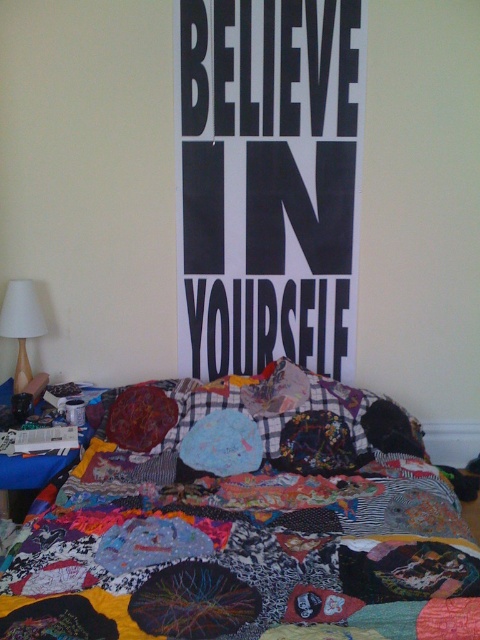
Is point (319, 33) farther from viewer compared to point (19, 355)?

No, (319, 33) is closer to viewer.

The height and width of the screenshot is (640, 480). Describe the element at coordinates (267, 182) in the screenshot. I see `black paper poster at center` at that location.

Does point (308, 244) come farther from viewer compared to point (17, 289)?

Yes, it is.

Find the location of a particular element. The width and height of the screenshot is (480, 640). black paper poster at center is located at coordinates (267, 182).

Is point (377, 508) closer to viewer compared to point (230, 340)?

Yes.

How much distance is there between patchwork quilt at center and black paper poster at center?

patchwork quilt at center is 83.21 centimeters away from black paper poster at center.

Describe the element at coordinates (250, 534) in the screenshot. I see `patchwork quilt at center` at that location.

Locate an element on the screen. patchwork quilt at center is located at coordinates tap(250, 534).

Can you confirm if patchwork quilt at center is taller than white fabric lampshade at left?

Indeed, patchwork quilt at center has a greater height compared to white fabric lampshade at left.

Which is behind, point (283, 433) or point (13, 285)?

The point (13, 285) is more distant.

Image resolution: width=480 pixels, height=640 pixels. I want to click on patchwork quilt at center, so click(x=250, y=534).